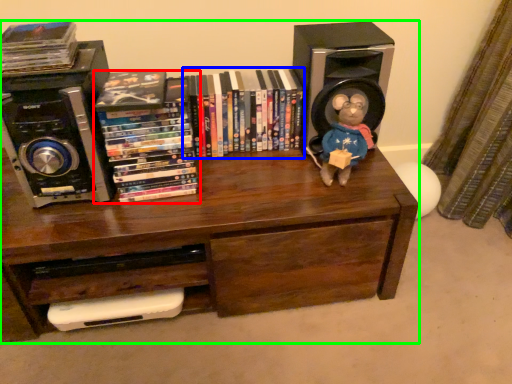
Question: Which is nearer to the book (highlighted by a red box)? book (highlighted by a blue box) or bookcase (highlighted by a green box).

Choices:
 (A) book
 (B) bookcase

Answer: (A)